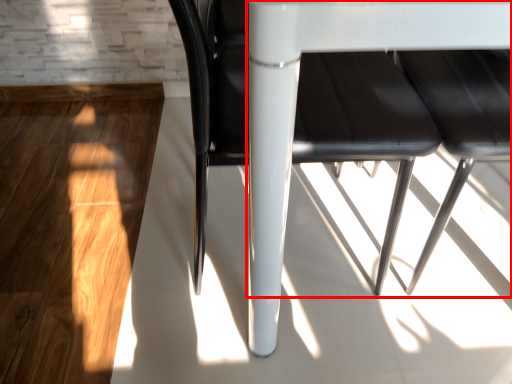
Question: From the image's perspective, what is the correct spatial relationship of table (annotated by the red box) in relation to chair?

Choices:
 (A) below
 (B) above

Answer: (B)